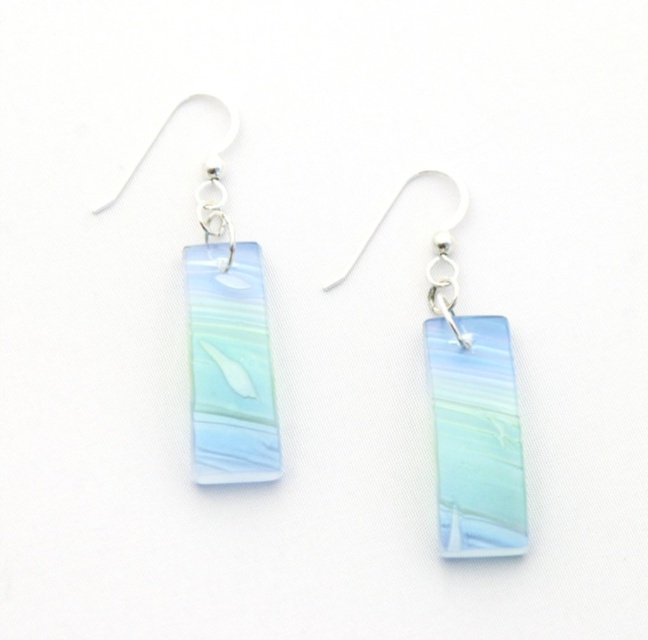
You are a jeweler trying to package these earrings. The packaging box has a divider that can only fit one earring at a time. If you place the translucent glass rectangle at center and the translucent glass pendant at center into the box, which one will be closer to the divider?

The translucent glass rectangle at center is 1.72 centimeters from the translucent glass pendant at center, so the translucent glass pendant at center will be closer to the divider if the divider is placed between them.